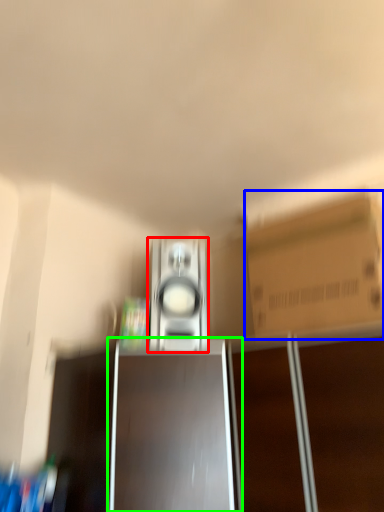
Question: Which object is the closest to the home appliance (highlighted by a red box)? Choose among these: cardboard box (highlighted by a blue box) or cabinetry (highlighted by a green box).

Choices:
 (A) cardboard box
 (B) cabinetry

Answer: (B)